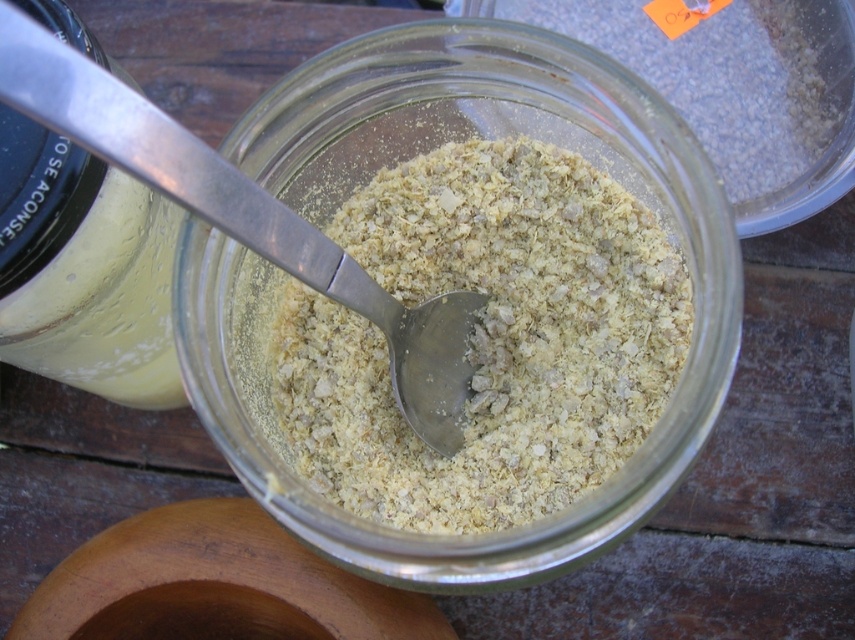
Question: Where is white crumbly substance at center located in relation to silver metallic spoon at center in the image?

Choices:
 (A) below
 (B) above

Answer: (A)

Question: Among these objects, which one is nearest to the camera?

Choices:
 (A) silver metallic spoon at center
 (B) white crumbly substance at center

Answer: (A)

Question: Which of the following is the farthest from the observer?

Choices:
 (A) (628, 310)
 (B) (155, 128)

Answer: (A)

Question: Is white crumbly substance at center below silver metallic spoon at center?

Choices:
 (A) yes
 (B) no

Answer: (A)

Question: Can you confirm if white crumbly substance at center is positioned to the right of silver metallic spoon at center?

Choices:
 (A) yes
 (B) no

Answer: (A)

Question: Which object is closer to the camera taking this photo?

Choices:
 (A) silver metallic spoon at center
 (B) white crumbly substance at center

Answer: (A)